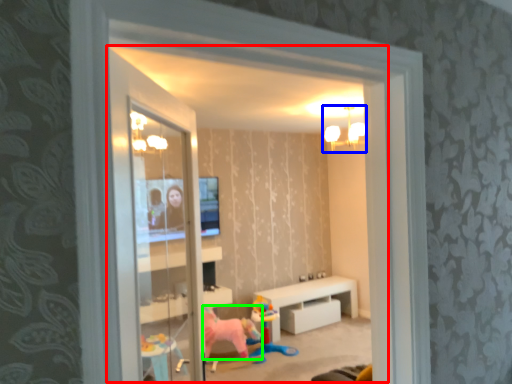
Question: Which object is positioned closest to window (highlighted by a red box)? Select from light fixture (highlighted by a blue box) and animal (highlighted by a green box).

Choices:
 (A) light fixture
 (B) animal

Answer: (A)